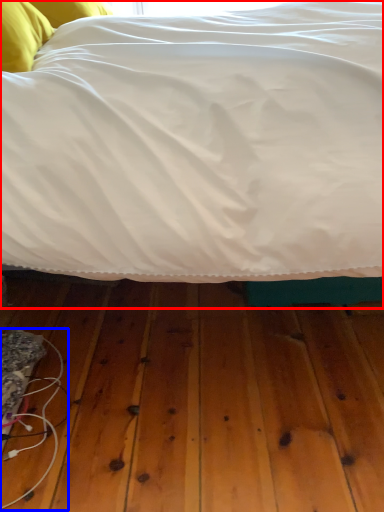
Question: Among these objects, which one is nearest to the camera, bed (highlighted by a red box) or wire (highlighted by a blue box)?

Choices:
 (A) bed
 (B) wire

Answer: (A)